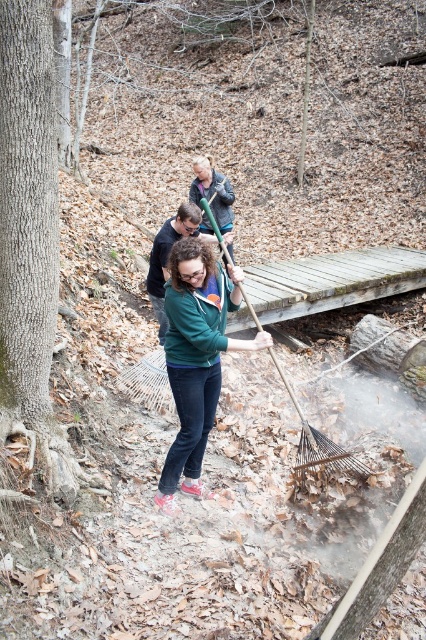
Consider the image. You are standing on the wooden bridge and want to take a photo of both the dark blue jeans at center and the dark blue jacket at upper center. Which one should you focus on first to ensure both are in the frame?

You should focus on the dark blue jacket at upper center first because the dark blue jeans at center is in front of it, so adjusting the camera to include the jacket behind will naturally include the jeans in the foreground.

You are a hiker who wants to determine which clothing item is more visible from a distance in the wooded area. Based on the scene description, which item would stand out more between the matte green sweater at center and the dark blue jacket at upper center?

The matte green sweater at center is bigger than the dark blue jacket at upper center, so it would stand out more from a distance due to its larger size.